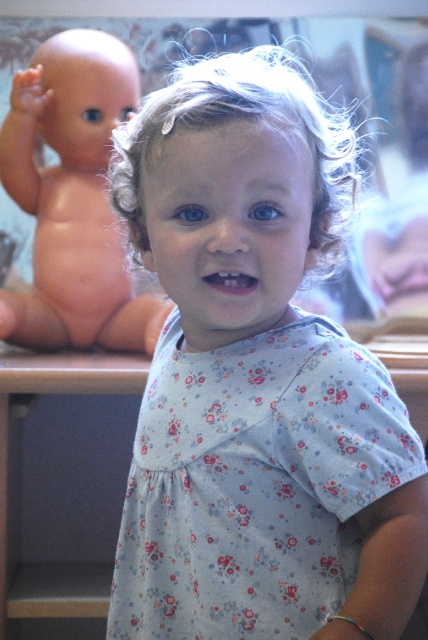
Does point (226, 502) come closer to viewer compared to point (109, 76)?

Yes, point (226, 502) is in front of point (109, 76).

Does floral cotton dress at center have a greater width compared to pink matte doll at left?

In fact, floral cotton dress at center might be narrower than pink matte doll at left.

Who is more distant from viewer, (350, 509) or (35, 320)?

Positioned behind is point (35, 320).

Image resolution: width=428 pixels, height=640 pixels. Identify the location of floral cotton dress at center. (255, 483).